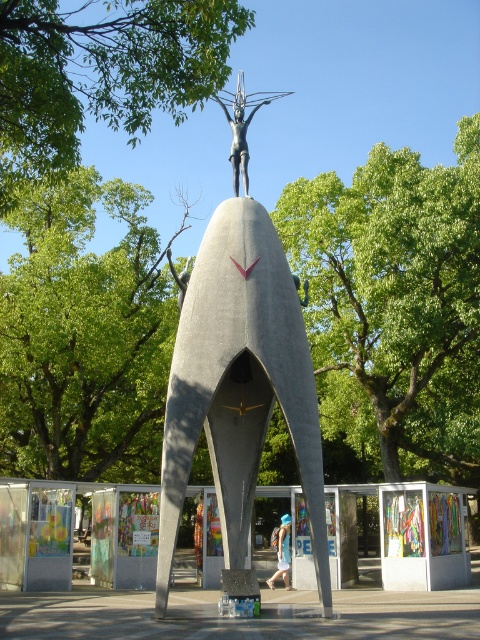
Which of these two, gray polished concrete statue at center or green leafy tree at upper center, stands shorter?

green leafy tree at upper center is shorter.

Can you confirm if gray polished concrete statue at center is taller than green leafy tree at upper center?

Indeed, gray polished concrete statue at center has a greater height compared to green leafy tree at upper center.

Who is more distant from viewer, (225, 451) or (111, 90)?

The point (225, 451) is behind.

Locate an element on the screen. This screenshot has width=480, height=640. gray polished concrete statue at center is located at coordinates (239, 385).

Between gray polished concrete statue at center and polished bronze statue at center, which one appears on the right side from the viewer's perspective?

From the viewer's perspective, polished bronze statue at center appears more on the right side.

Can you confirm if gray polished concrete statue at center is positioned below polished bronze statue at center?

Indeed, gray polished concrete statue at center is positioned under polished bronze statue at center.

Is point (220, 480) in front of point (272, 93)?

Yes, point (220, 480) is closer to viewer.

You are a GUI agent. You are given a task and a screenshot of the screen. Output one action in this format:
    pyautogui.click(x=<x>, y=<y>)
    Task: Click on the gray polished concrete statue at center
    The width and height of the screenshot is (480, 640).
    Given the screenshot: What is the action you would take?
    pyautogui.click(x=239, y=385)

Is polished bronze statue at center to the left of blue denim shorts at center from the viewer's perspective?

Correct, you'll find polished bronze statue at center to the left of blue denim shorts at center.

Looking at this image, who is shorter, polished bronze statue at center or blue denim shorts at center?

blue denim shorts at center

Is point (248, 188) less distant than point (285, 547)?

Yes, it is in front of point (285, 547).

Locate an element on the screen. The width and height of the screenshot is (480, 640). polished bronze statue at center is located at coordinates (242, 125).